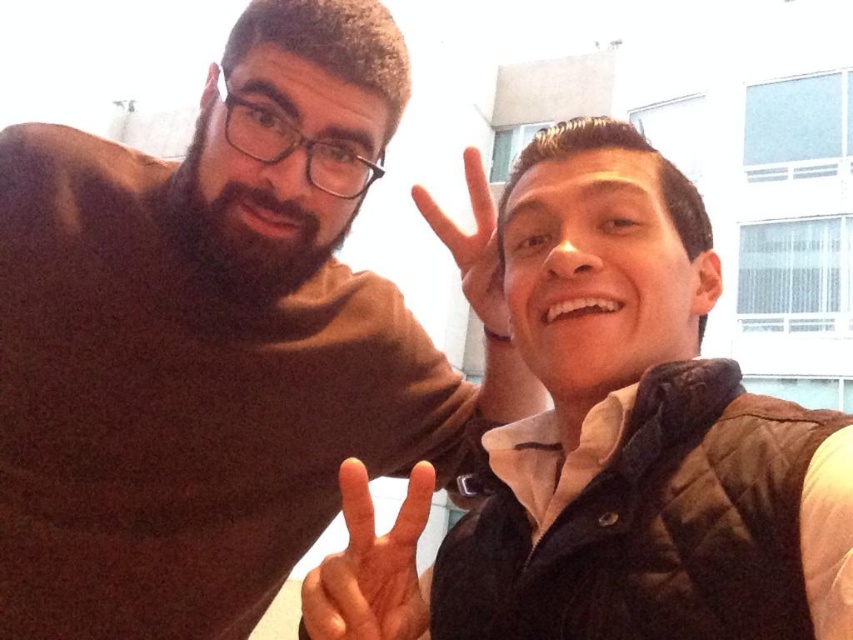
You are a photographer trying to adjust the lighting for a portrait. You notice the brown matte shirt at left and the light skin tone flesh at center in the frame. Which object should you adjust the exposure settings for to avoid overexposure, and why?

The light skin tone flesh at center should be adjusted because the brown matte shirt at left is above it, meaning the shirt might be in a darker area, while the skin could be getting more direct light from the overexposed sky background, leading to overexposure.

You are a photographer trying to adjust the lighting for a photo. You notice the brown matte shirt at left is positioned at a specific coordinate. Based on the scene description, can you determine if the shirt is in a well lit area?

The brown matte shirt at left is located at point (219, 339). Since the scene has a bright, overexposed sky in the background, it is likely that the shirt is in a well lit area.